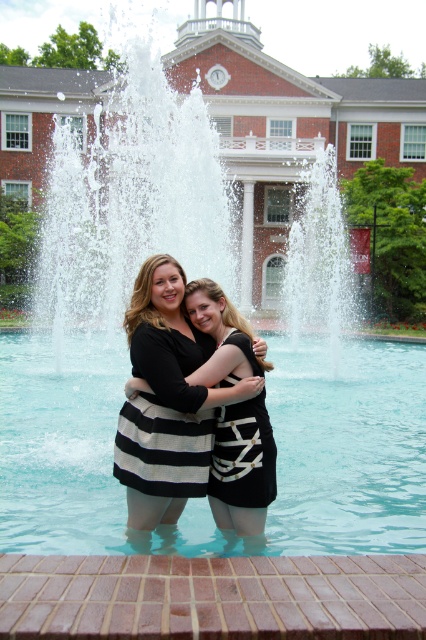
You are a photographer trying to capture the height of the clear blue water at center and the black striped dress at center in the fountain scene. Which object is taller?

The black striped dress at center is taller than the clear blue water at center.